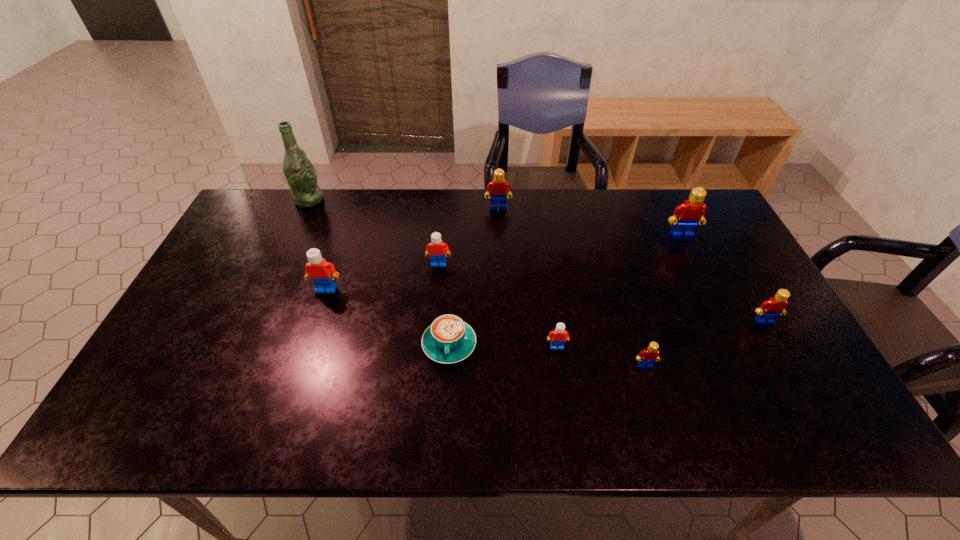
Identify the location of object at the far right corner. (690, 213).

Where is `vacant space at the far edge of the desktop`? Image resolution: width=960 pixels, height=540 pixels. vacant space at the far edge of the desktop is located at coordinates (328, 225).

I want to click on free space at the near edge, so click(x=259, y=429).

The width and height of the screenshot is (960, 540). In the image, there is a desktop. In order to click on vacant area at the left edge in this screenshot , I will do `click(227, 249)`.

This screenshot has width=960, height=540. In the image, there is a desktop. What are the coordinates of `vacant space at the right edge` in the screenshot? It's located at 747,299.

This screenshot has height=540, width=960. In the image, there is a desktop. Find the location of `vacant space at the far left corner`. vacant space at the far left corner is located at coordinates (242, 217).

Where is `vacant space that is in between the leftmost red Lego and the second nearest Lego`? vacant space that is in between the leftmost red Lego and the second nearest Lego is located at coordinates (527, 277).

This screenshot has width=960, height=540. What are the coordinates of `free spot between the tallest Lego and the rightmost Lego` in the screenshot? It's located at pos(723,278).

Identify the location of empty location between the tallest object and the turquoise cappuccino. (379, 272).

Locate an element on the screen. The width and height of the screenshot is (960, 540). empty location between the sixth Lego from right to left and the rightmost white Lego is located at coordinates pyautogui.click(x=498, y=305).